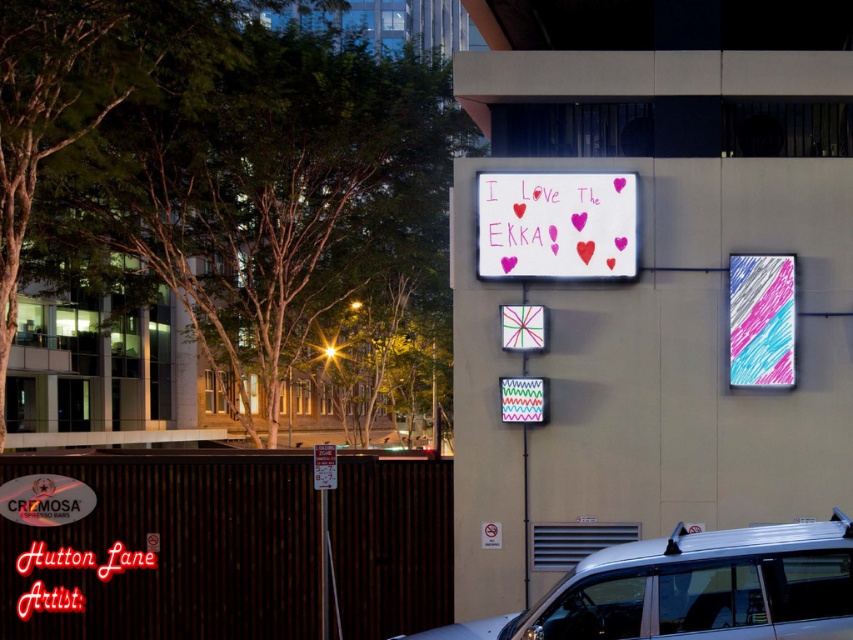
You are an event organizer planning to place a new decorative banner between the multicolored fabric sign at center and the white glossy sign at upper center. Based on their sizes, which sign should the banner be placed closer to for better visual balance?

The multicolored fabric sign at center is larger than the white glossy sign at upper center, so placing the banner closer to the multicolored fabric sign at center would create better visual balance by compensating for its larger size.

You are standing in front of the building and see a silver metallic van at lower right. Where would you look to find the point at coordinate [694,589]?

The point at coordinate [694,589] corresponds to the silver metallic van at lower right.

In the scene shown: You are an event organizer who wants to place a new promotional banner between the white paperboard at center and the white glossy sign at upper center. Based on their sizes, which object should the banner be placed closer to?

The white paperboard at center is bigger than the white glossy sign at upper center, so the banner should be placed closer to the white glossy sign at upper center to maintain visual balance.